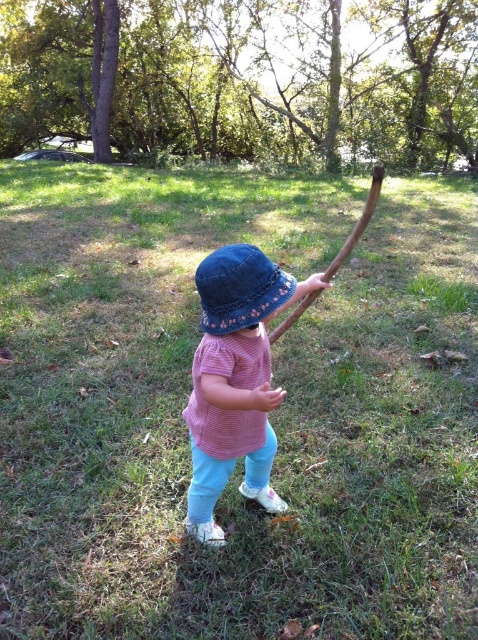
You are a tailor measuring the clothing items in the image. The pink striped shirt at center needs to be adjusted so that it is 1 inch closer to the denim hat at center. Is this adjustment possible without overlapping the two items?

The current distance between the pink striped shirt at center and the denim hat at center is 12.96 inches. Reducing the distance by 1 inch would make it 11.96 inches apart. Since this adjustment keeps them separated by over 11 inches, it is possible to move the pink striped shirt at center closer to the denim hat at center by 1 inch without overlapping.

Based on the coordinates provided, which object is located at point (235, 380) in the image?

The point (235, 380) indicates the pink striped shirt at center.

The child is wearing a pink striped shirt at center and a denim hat at center. Which clothing item is larger in size?

The pink striped shirt at center is bigger than the denim hat at center.